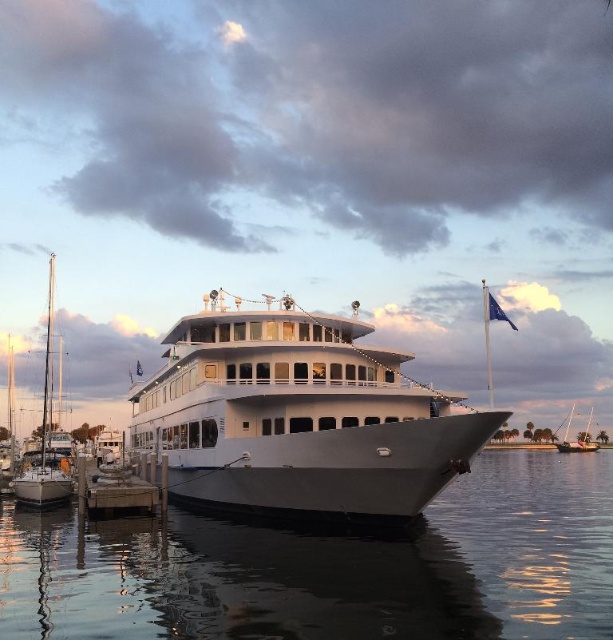
Who is more distant from viewer, (159, 579) or (48, 268)?

Point (48, 268)

Which of these two, clear water at lower center or white glossy sailboat at left, stands taller?

white glossy sailboat at left is taller.

Which is behind, point (596, 476) or point (25, 456)?

Positioned behind is point (25, 456).

Locate an element on the screen. The height and width of the screenshot is (640, 613). clear water at lower center is located at coordinates (333, 568).

Is point (421, 548) more distant than point (154, 412)?

No.

Which is below, clear water at lower center or white glossy yacht at center?

clear water at lower center is below.

Describe the element at coordinates (333, 568) in the screenshot. The height and width of the screenshot is (640, 613). I see `clear water at lower center` at that location.

Find the location of `clear water at lower center`. clear water at lower center is located at coordinates (333, 568).

Is point (324, 502) behind point (80, 467)?

That is False.

Consider the image. Can you confirm if white glossy yacht at center is positioned below wooden dock at lower left?

No, white glossy yacht at center is not below wooden dock at lower left.

Where is `white glossy yacht at center`? This screenshot has width=613, height=640. white glossy yacht at center is located at coordinates point(299,417).